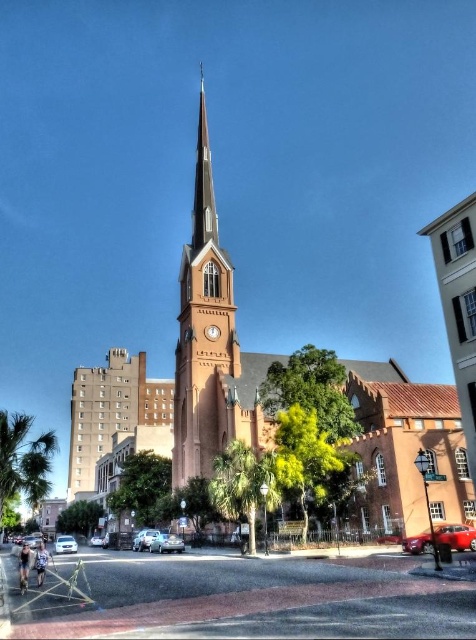
Question: Can you confirm if brick steeple at center is positioned above metallic silver sedan at lower left?

Choices:
 (A) no
 (B) yes

Answer: (B)

Question: Does metallic silver sedan at center appear on the right side of silver metallic sedan at center?

Choices:
 (A) no
 (B) yes

Answer: (B)

Question: Estimate the real-world distances between objects in this image. Which object is closer to the silver metallic car at lower left?

Choices:
 (A) matte brick church at center
 (B) metallic silver sedan at lower left
 (C) silver metallic sedan at center

Answer: (B)

Question: Which point appears farthest from the camera in this image?

Choices:
 (A) (98, 544)
 (B) (81, 456)
 (C) (38, 440)
 (D) (218, 328)

Answer: (B)

Question: Can you confirm if green leafy palm tree at lower left is positioned to the left of silver metallic car at lower left?

Choices:
 (A) no
 (B) yes

Answer: (B)

Question: Based on their relative distances, which object is farther from the metallic silver sedan at center?

Choices:
 (A) silver metallic car at lower left
 (B) green leafy palm tree at lower left
 (C) metallic silver car at center
 (D) metallic red car at lower right

Answer: (A)